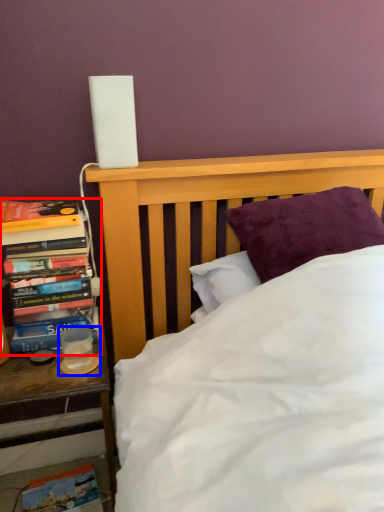
Question: Which object is closer to the camera taking this photo, book (highlighted by a red box) or candle holder (highlighted by a blue box)?

Choices:
 (A) book
 (B) candle holder

Answer: (A)